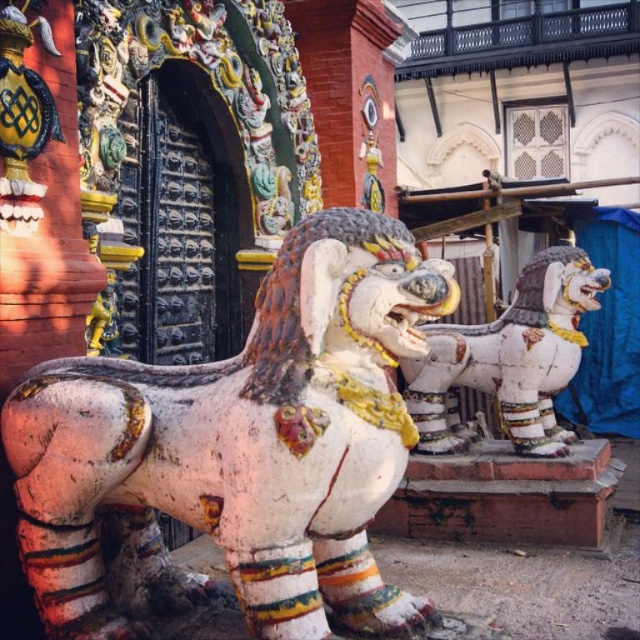
You are a tourist standing at the entrance of the temple and want to take a photo of both the painted wood lion at center and the white painted stone lion at center. Which one should you point your camera downward to capture?

You should point your camera downward to capture the painted wood lion at center because it is located below the white painted stone lion at center.